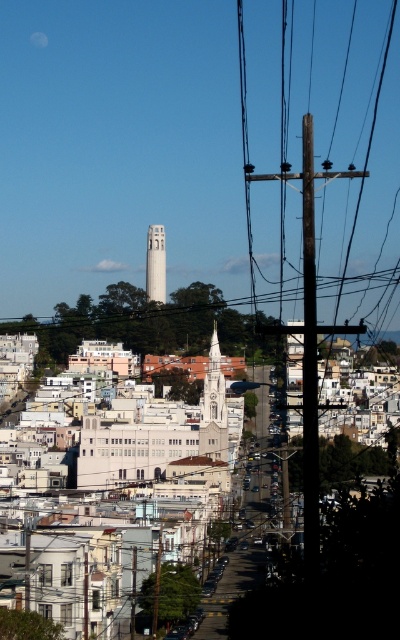
This screenshot has height=640, width=400. Find the location of `wooden pole at right`. wooden pole at right is located at coordinates (322, 150).

Who is more forward, (270,49) or (218,346)?

Positioned in front is point (218,346).

What do you see at coordinates (322, 150) in the screenshot? This screenshot has height=640, width=400. I see `wooden pole at right` at bounding box center [322, 150].

What are the coordinates of `wooden pole at right` in the screenshot? It's located at (322, 150).

Is white stone clock tower at center smaller than white concrete tower at center?

No.

Based on the photo, does white stone clock tower at center have a larger size compared to white concrete tower at center?

Correct, white stone clock tower at center is larger in size than white concrete tower at center.

Is point (224, 426) behind point (151, 227)?

No, (224, 426) is in front of (151, 227).

Identify the location of white stone clock tower at center. (214, 406).

Consider the image. Does wooden pole at right appear over dark brown wooden telegraph pole at center?

Correct, wooden pole at right is located above dark brown wooden telegraph pole at center.

Is wooden pole at right positioned before dark brown wooden telegraph pole at center?

That is False.

Which is in front, point (380, 88) or point (310, 492)?

Point (310, 492) is in front.

The height and width of the screenshot is (640, 400). I want to click on wooden pole at right, so click(322, 150).